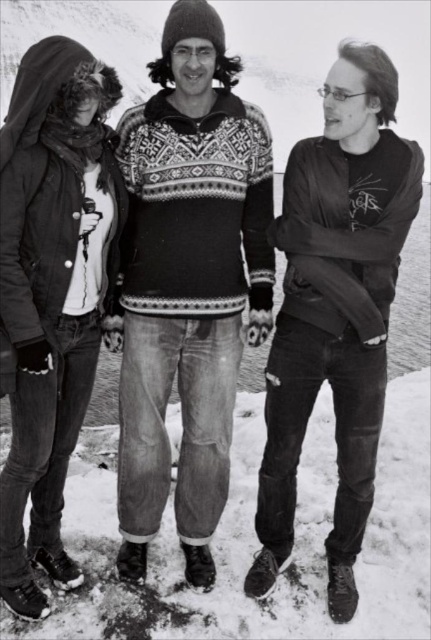
Does denim jacket at left appear on the right side of brushed metal jacket at left?

Correct, you'll find denim jacket at left to the right of brushed metal jacket at left.

Is denim jacket at left bigger than brushed metal jacket at left?

Correct, denim jacket at left is larger in size than brushed metal jacket at left.

At what (x,y) coordinates should I click in order to perform the action: click on denim jacket at left. Please return your answer as a coordinate pair (x, y). Image resolution: width=431 pixels, height=640 pixels. Looking at the image, I should click on (187, 284).

Find the location of `denim jacket at left`. denim jacket at left is located at coordinates (187, 284).

Between matte black jacket at center and brushed metal jacket at left, which one is positioned higher?

matte black jacket at center is above.

Who is more forward, (349, 195) or (84, 211)?

Point (84, 211)

The width and height of the screenshot is (431, 640). Describe the element at coordinates (336, 308) in the screenshot. I see `matte black jacket at center` at that location.

The image size is (431, 640). I want to click on matte black jacket at center, so click(336, 308).

Between point (177, 259) and point (324, 323), which one is positioned in front?

Point (324, 323) is in front.

Which of these two, denim jacket at left or matte black jacket at center, stands taller?

denim jacket at left is taller.

Between point (124, 177) and point (306, 337), which one is positioned in front?

Point (306, 337) is more forward.

You are a GUI agent. You are given a task and a screenshot of the screen. Output one action in this format:
    pyautogui.click(x=<x>, y=<y>)
    Task: Click on the denim jacket at left
    This screenshot has width=431, height=640.
    Given the screenshot: What is the action you would take?
    pyautogui.click(x=187, y=284)